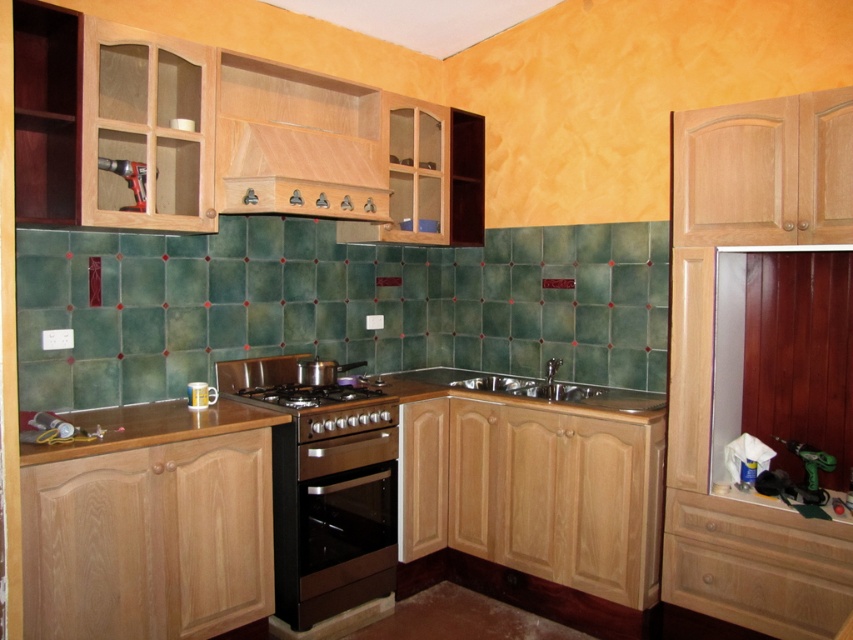
Question: Is brown wood countertop at lower left behind satin nickel sink at center?

Choices:
 (A) yes
 (B) no

Answer: (B)

Question: Which of the following is the closest to the observer?

Choices:
 (A) (578, 388)
 (B) (306, 401)

Answer: (B)

Question: Among these objects, which one is farthest from the camera?

Choices:
 (A) brown wood countertop at lower left
 (B) white glossy mug at lower left

Answer: (B)

Question: Is black stainless steel oven at center bigger than white glossy mug at lower left?

Choices:
 (A) no
 (B) yes

Answer: (B)

Question: Which point is closer to the camera?

Choices:
 (A) (525, 381)
 (B) (312, 394)
 (C) (200, 403)
 (D) (299, 532)

Answer: (D)

Question: Does black stainless steel oven at center have a greater width compared to brown wood countertop at lower left?

Choices:
 (A) yes
 (B) no

Answer: (B)